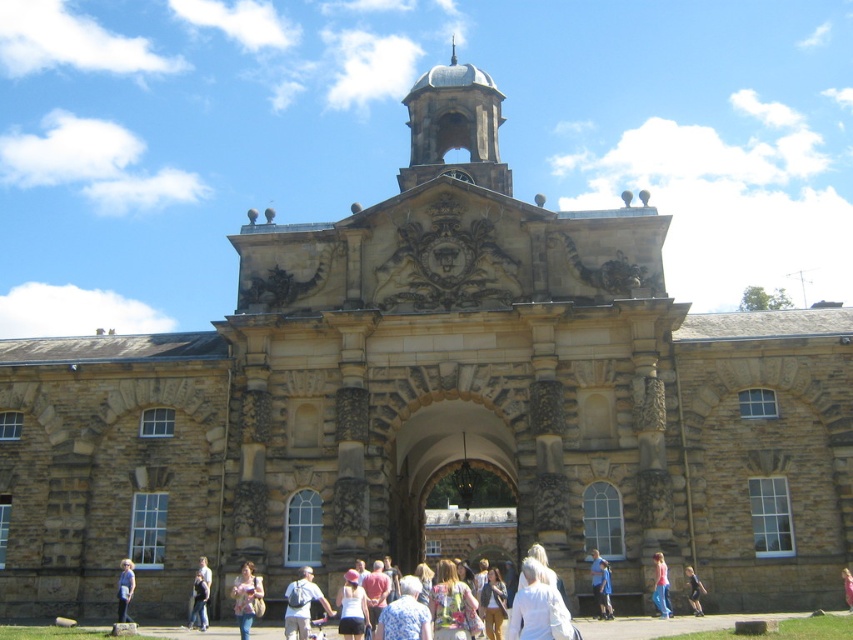
Does blue denim jeans at lower center appear on the right side of pink fabric at center?

Incorrect, blue denim jeans at lower center is not on the right side of pink fabric at center.

What do you see at coordinates (599, 582) in the screenshot? This screenshot has height=640, width=853. I see `blue denim jeans at lower center` at bounding box center [599, 582].

Which is in front, point (601, 609) or point (849, 605)?

Point (601, 609)

The image size is (853, 640). In order to click on blue denim jeans at lower center in this screenshot , I will do `click(599, 582)`.

Who is taller, white matte jacket at center or dark blue jeans at center?

white matte jacket at center is taller.

Between white matte jacket at center and dark blue jeans at center, which one appears on the left side from the viewer's perspective?

From the viewer's perspective, white matte jacket at center appears more on the left side.

Which is in front, point (512, 604) or point (694, 611)?

Positioned in front is point (694, 611).

The width and height of the screenshot is (853, 640). What are the coordinates of `white matte jacket at center` in the screenshot? It's located at (538, 608).

Does point (234, 579) come behind point (849, 576)?

No, it is in front of (849, 576).

Who is more distant from viewer, (x=258, y=579) or (x=846, y=595)?

The point (x=846, y=595) is more distant.

Image resolution: width=853 pixels, height=640 pixels. Find the location of `denim jeans at center`. denim jeans at center is located at coordinates (247, 596).